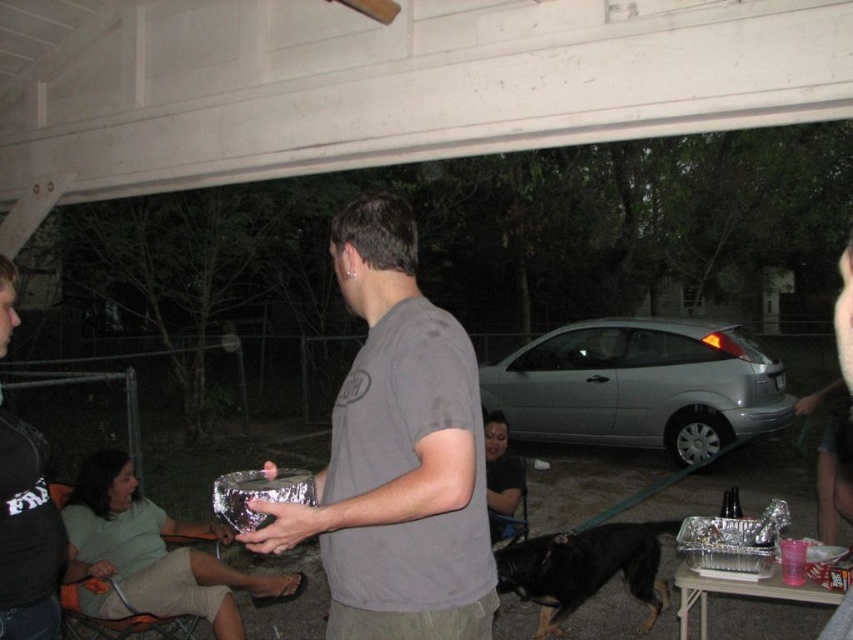
You are standing at the covered structure and want to move from point A to point B. Point A is at coordinates point (480, 392) and point B is at point (646, 566). Which point is closer to you?

Point A at coordinates point (480, 392) is closer to you because it is further to the viewer than point B at point (646, 566).

You are at a nighttime gathering under a covered structure. You see a silver metallic car at center and a black fur dog at lower center. Which object is positioned higher from the ground?

The silver metallic car at center is located above the black fur dog at lower center, so the silver metallic car at center is positioned higher from the ground.